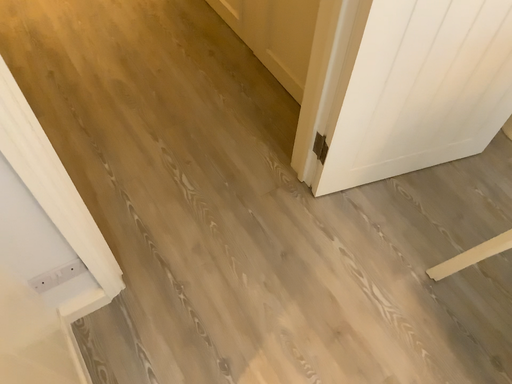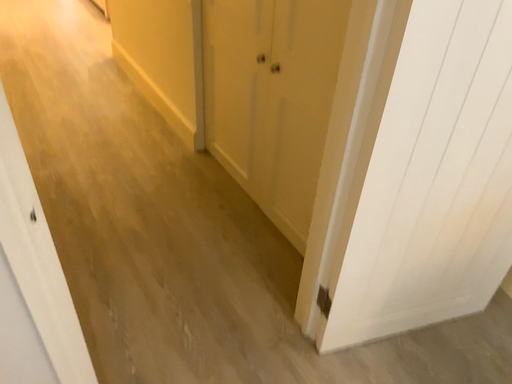
Question: Which way did the camera rotate in the video?

Choices:
 (A) rotated upward
 (B) rotated downward

Answer: (A)